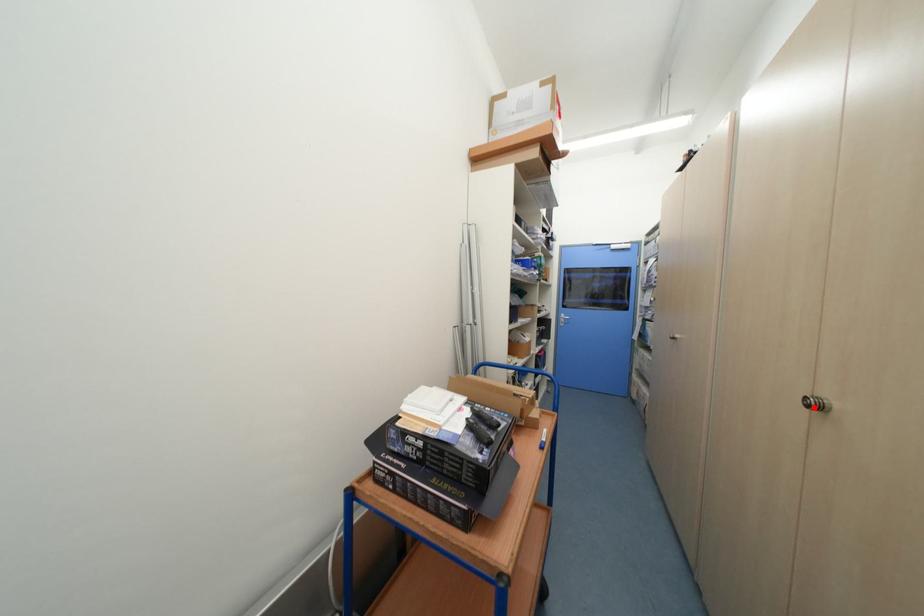
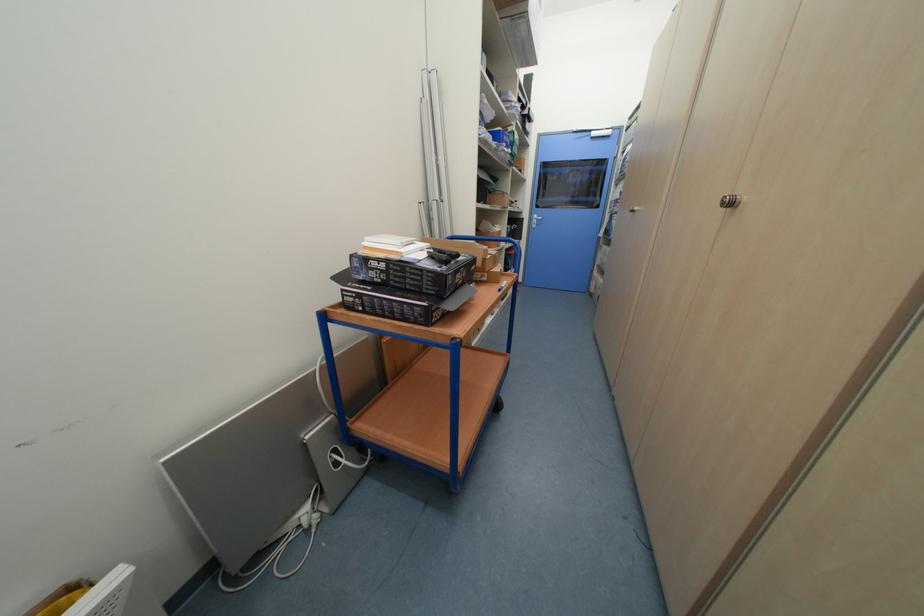
Where in the second image is the point corresponding to the highlighted location from the first image?

(728, 206)